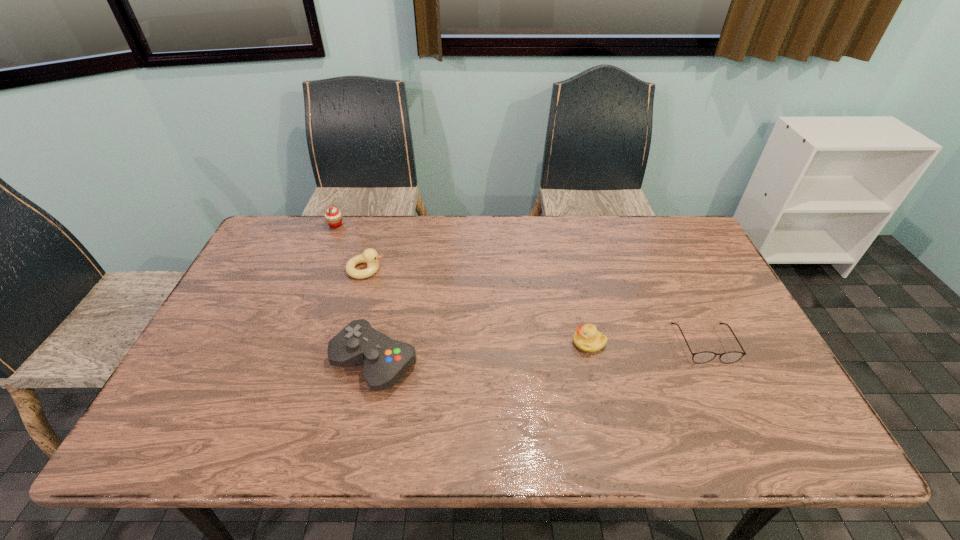
This screenshot has height=540, width=960. What are the coordinates of `vacant space located on the right of the control` in the screenshot? It's located at (560, 362).

Where is `vacant area situated at the beak of the farther duckling`? vacant area situated at the beak of the farther duckling is located at coordinates (458, 269).

Find the location of a particular element. free region located at the face of the fourth object from left to right is located at coordinates click(519, 343).

The width and height of the screenshot is (960, 540). Identify the location of vacant area located at the face of the fourth object from left to right. click(516, 343).

Find the location of `vacant space located at the face of the fourth object from left to right`. vacant space located at the face of the fourth object from left to right is located at coordinates (440, 343).

Where is `vacant space situated on the front-facing side of the shortest object`? Image resolution: width=960 pixels, height=540 pixels. vacant space situated on the front-facing side of the shortest object is located at coordinates (744, 427).

The width and height of the screenshot is (960, 540). Find the location of `cupcake located in the far edge section of the desktop`. cupcake located in the far edge section of the desktop is located at coordinates (333, 217).

The height and width of the screenshot is (540, 960). I want to click on duckling at the far edge, so click(369, 256).

This screenshot has width=960, height=540. I want to click on object located in the right edge section of the desktop, so click(706, 356).

This screenshot has width=960, height=540. Identify the location of free space at the far edge. (543, 244).